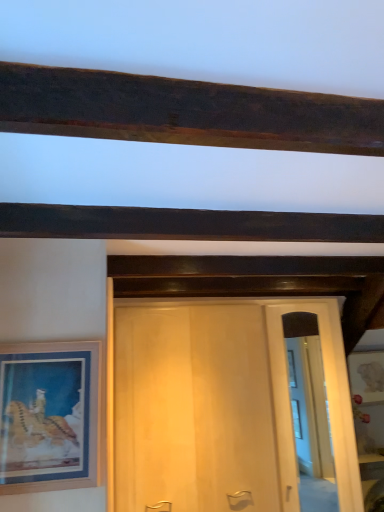
Question: From a real-world perspective, is dark wood beam at upper center beneath clear glass door at center?

Choices:
 (A) no
 (B) yes

Answer: (A)

Question: Is dark wood beam at upper center to the left of clear glass door at center from the viewer's perspective?

Choices:
 (A) no
 (B) yes

Answer: (B)

Question: From a real-world perspective, is dark wood beam at upper center on top of clear glass door at center?

Choices:
 (A) no
 (B) yes

Answer: (B)

Question: Are dark wood beam at upper center and clear glass door at center beside each other?

Choices:
 (A) no
 (B) yes

Answer: (A)

Question: Is the depth of dark wood beam at upper center greater than that of clear glass door at center?

Choices:
 (A) no
 (B) yes

Answer: (A)

Question: Considering the relative sizes of dark wood beam at upper center and clear glass door at center in the image provided, is dark wood beam at upper center bigger than clear glass door at center?

Choices:
 (A) no
 (B) yes

Answer: (B)

Question: Could you tell me if wooden picture frame at left is facing dark wood beam at upper center?

Choices:
 (A) yes
 (B) no

Answer: (B)

Question: Is wooden picture frame at left beside dark wood beam at upper center?

Choices:
 (A) no
 (B) yes

Answer: (A)

Question: Does wooden picture frame at left come behind dark wood beam at upper center?

Choices:
 (A) yes
 (B) no

Answer: (A)

Question: Is wooden picture frame at left taller than dark wood beam at upper center?

Choices:
 (A) no
 (B) yes

Answer: (B)

Question: Is wooden picture frame at left at the right side of dark wood beam at upper center?

Choices:
 (A) no
 (B) yes

Answer: (A)

Question: Considering the relative sizes of wooden picture frame at left and dark wood beam at upper center in the image provided, is wooden picture frame at left bigger than dark wood beam at upper center?

Choices:
 (A) no
 (B) yes

Answer: (A)

Question: Does clear glass door at center turn towards dark wood beam at upper center?

Choices:
 (A) no
 (B) yes

Answer: (A)